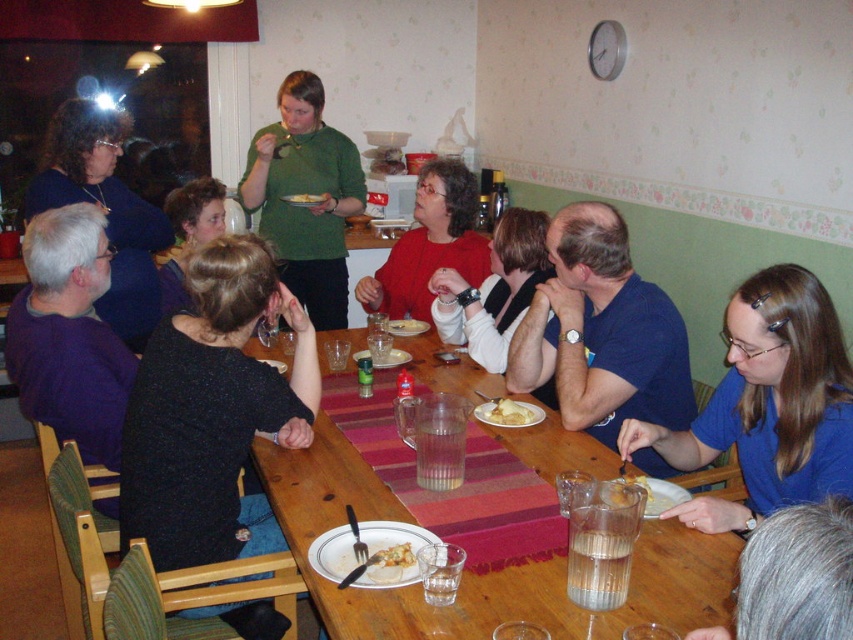
Question: Among these objects, which one is farthest from the camera?

Choices:
 (A) dark blue shirt at center
 (B) yellowish matte bread at center
 (C) white sweater at center

Answer: (C)

Question: Among these points, which one is farthest from the camera?

Choices:
 (A) (375, 560)
 (B) (502, 412)

Answer: (B)

Question: Is matte black sweater at upper left positioned at the back of yellow matte pizza at center?

Choices:
 (A) yes
 (B) no

Answer: (B)

Question: Does white porcelain plate at center appear on the left side of golden crispy pastry at center?

Choices:
 (A) yes
 (B) no

Answer: (A)

Question: Can you confirm if wooden table at center is smaller than purple sweater at left?

Choices:
 (A) yes
 (B) no

Answer: (B)

Question: Which object is farther from the camera taking this photo?

Choices:
 (A) matte black sweater at upper left
 (B) gray hair at lower right
 (C) white porcelain plate at center

Answer: (C)